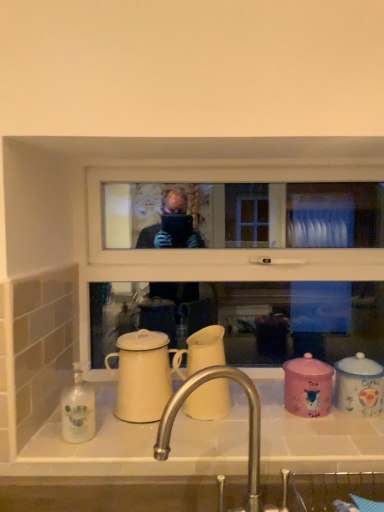
Question: In terms of width, does white matte coffee cup at center, the third coffee cup when ordered from right to left, look wider or thinner when compared to pink ceramic jar at lower right, which appears as the 3th coffee cup when viewed from the left?

Choices:
 (A) wide
 (B) thin

Answer: (A)

Question: Considering the relative positions of white matte coffee cup at center, the second coffee cup in the left-to-right sequence, and pink ceramic jar at lower right, which appears as the 3th coffee cup when viewed from the left, in the image provided, is white matte coffee cup at center, the second coffee cup in the left-to-right sequence, to the left or to the right of pink ceramic jar at lower right, which appears as the 3th coffee cup when viewed from the left,?

Choices:
 (A) left
 (B) right

Answer: (A)

Question: Estimate the real-world distances between objects in this image. Which object is closer to the pink ceramic jar at lower right, the second coffee cup viewed from the right?

Choices:
 (A) satin nickel faucet at center
 (B) white glossy sink at lower center
 (C) white matte coffee cup at center, the second coffee cup in the left-to-right sequence
 (D) blue glossy coffee cup at right, positioned as the 4th coffee cup in left-to-right order
 (E) white glossy bottle at lower left

Answer: (D)

Question: Based on their relative distances, which object is nearer to the satin nickel faucet at center?

Choices:
 (A) pink ceramic jar at lower right, the second coffee cup viewed from the right
 (B) white plastic window frame at upper center
 (C) blue glossy coffee cup at right, positioned as the 4th coffee cup in left-to-right order
 (D) white glossy sink at lower center
 (E) white glossy bottle at lower left

Answer: (D)